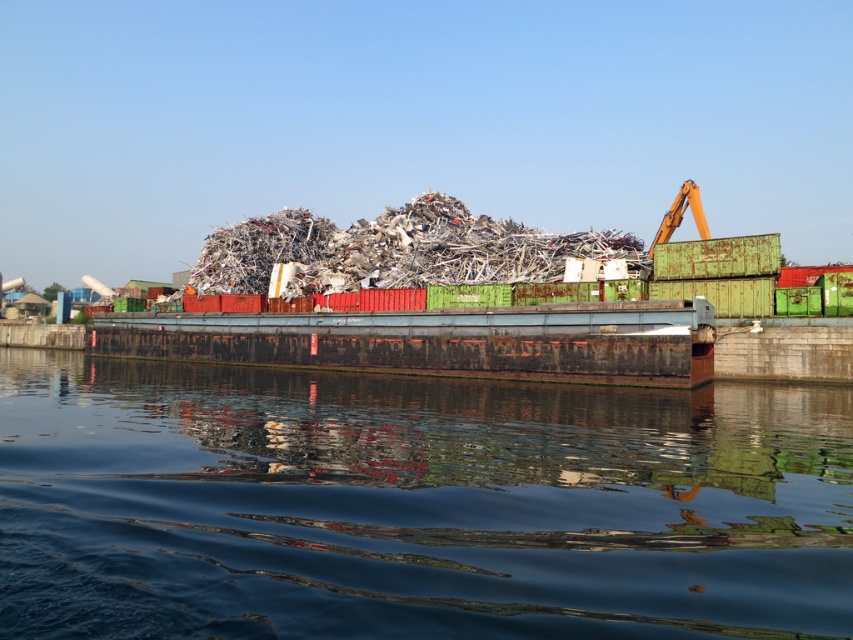
Does transparent water at center have a lesser height compared to shiny metallic debris at center?

Indeed, transparent water at center has a lesser height compared to shiny metallic debris at center.

Does point (675, 506) come farther from viewer compared to point (315, 253)?

No.

Identify the location of transparent water at center. (415, 506).

This screenshot has height=640, width=853. Describe the element at coordinates (415, 506) in the screenshot. I see `transparent water at center` at that location.

This screenshot has width=853, height=640. Identify the location of transparent water at center. (x=415, y=506).

Is rusty metal barge at center thinner than shiny metallic debris at center?

No.

Does rusty metal barge at center appear on the right side of shiny metallic debris at center?

No, rusty metal barge at center is not to the right of shiny metallic debris at center.

Is point (589, 312) positioned in front of point (502, 248)?

Yes, it is.

The image size is (853, 640). In order to click on rusty metal barge at center in this screenshot , I will do `click(439, 340)`.